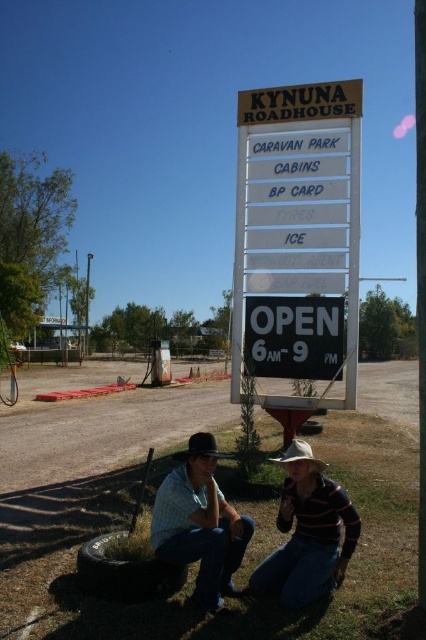
The height and width of the screenshot is (640, 426). Describe the element at coordinates (299, 204) in the screenshot. I see `brown wooden sign at center` at that location.

Is point (249, 250) closer to viewer compared to point (293, 440)?

No.

Where is `brown wooden sign at center`? This screenshot has width=426, height=640. brown wooden sign at center is located at coordinates (x=299, y=204).

Is brown wooden sign at center thinner than black felt cowboy hat at lower center?

In fact, brown wooden sign at center might be wider than black felt cowboy hat at lower center.

The image size is (426, 640). Describe the element at coordinates (299, 204) in the screenshot. I see `brown wooden sign at center` at that location.

Where is `brown wooden sign at center`? brown wooden sign at center is located at coordinates (299, 204).

Can you confirm if striped cotton shirt at lower center is shorter than denim jeans at lower center?

Yes.

Looking at this image, is striped cotton shirt at lower center bigger than denim jeans at lower center?

Correct, striped cotton shirt at lower center is larger in size than denim jeans at lower center.

Is point (322, 481) behind point (204, 508)?

Yes, it is.

Image resolution: width=426 pixels, height=640 pixels. In order to click on striped cotton shirt at lower center in this screenshot , I will do `click(307, 532)`.